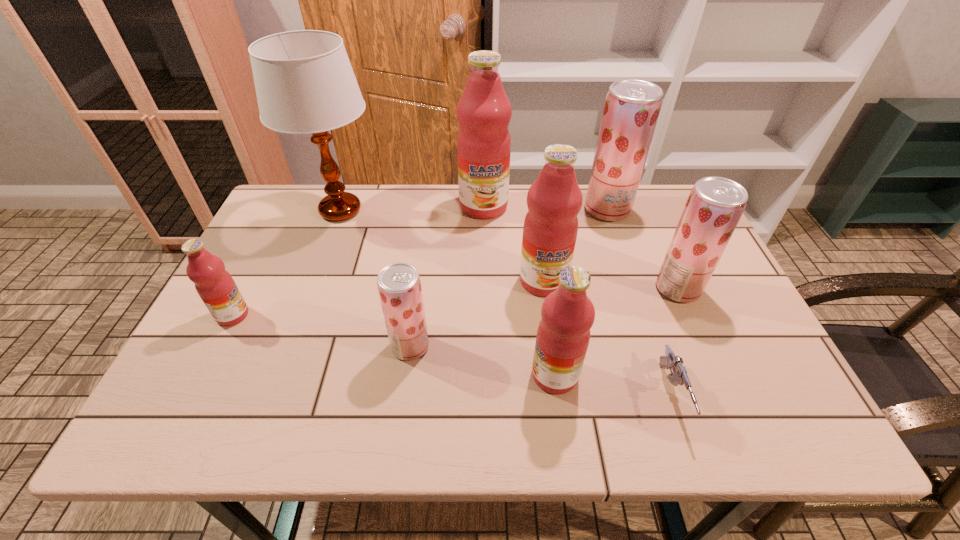
Identify which strawberry fruit juice is located as the nearest to the leftmost pink fruit juice. Please provide its 2D coordinates. Your answer should be formatted as a tuple, i.e. [(x, y)], where the tuple contains the x and y coordinates of a point satisfying the conditions above.

[(399, 286)]

The width and height of the screenshot is (960, 540). Find the location of `free space that satisfies the following two spatial constraints: 1. on the label of the second farthest pink fruit juice; 2. on the label of the nearest pink fruit juice`. free space that satisfies the following two spatial constraints: 1. on the label of the second farthest pink fruit juice; 2. on the label of the nearest pink fruit juice is located at coordinates pos(557,375).

Find the location of `vacant position in the image that satisfies the following two spatial constraints: 1. on the back side of the biggest strawberry fruit juice; 2. on the right side of the brown table lamp`. vacant position in the image that satisfies the following two spatial constraints: 1. on the back side of the biggest strawberry fruit juice; 2. on the right side of the brown table lamp is located at coordinates click(341, 210).

Where is `free region that satisfies the following two spatial constraints: 1. on the front side of the second farthest strawberry fruit juice; 2. on the right side of the brown table lamp`? The height and width of the screenshot is (540, 960). free region that satisfies the following two spatial constraints: 1. on the front side of the second farthest strawberry fruit juice; 2. on the right side of the brown table lamp is located at coordinates (312, 288).